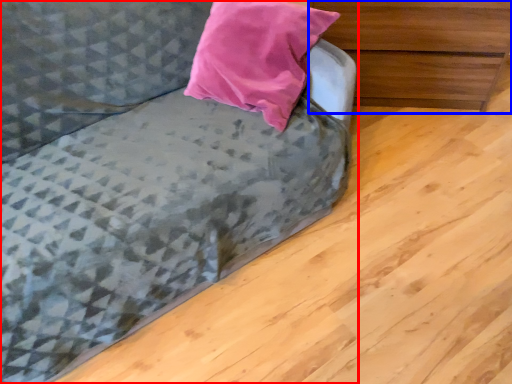
Question: Which of the following is the closest to the observer, studio couch (highlighted by a red box) or chest of drawers (highlighted by a blue box)?

Choices:
 (A) studio couch
 (B) chest of drawers

Answer: (A)